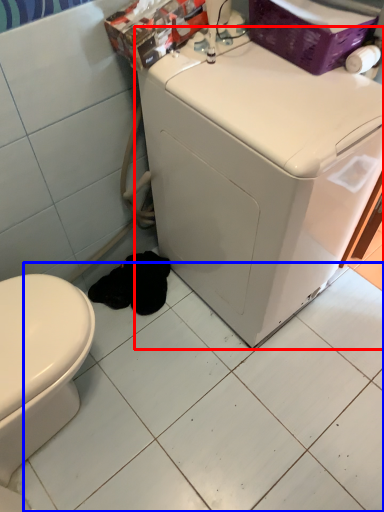
Question: Which object is closer to the camera taking this photo, washing machine (highlighted by a red box) or ceramic tile (highlighted by a blue box)?

Choices:
 (A) washing machine
 (B) ceramic tile

Answer: (A)